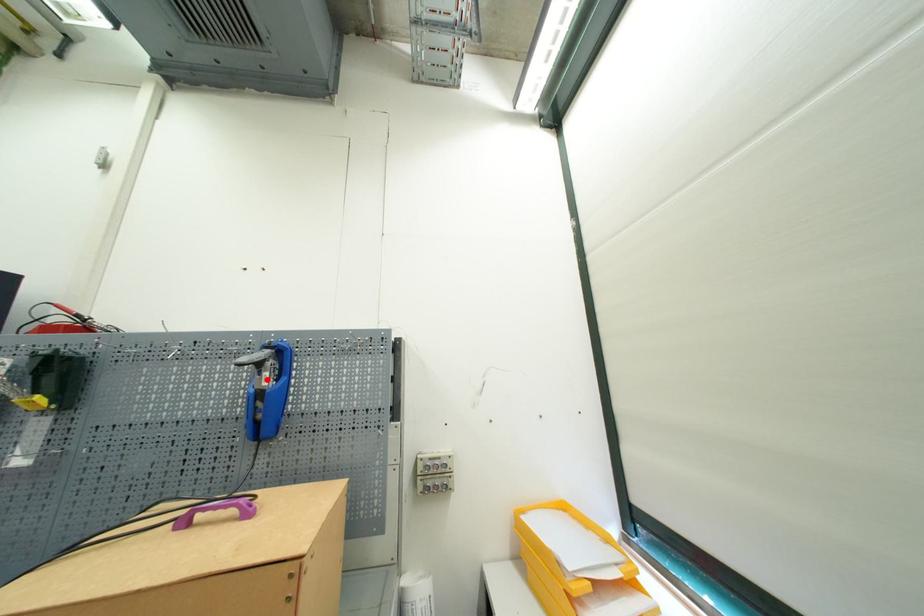
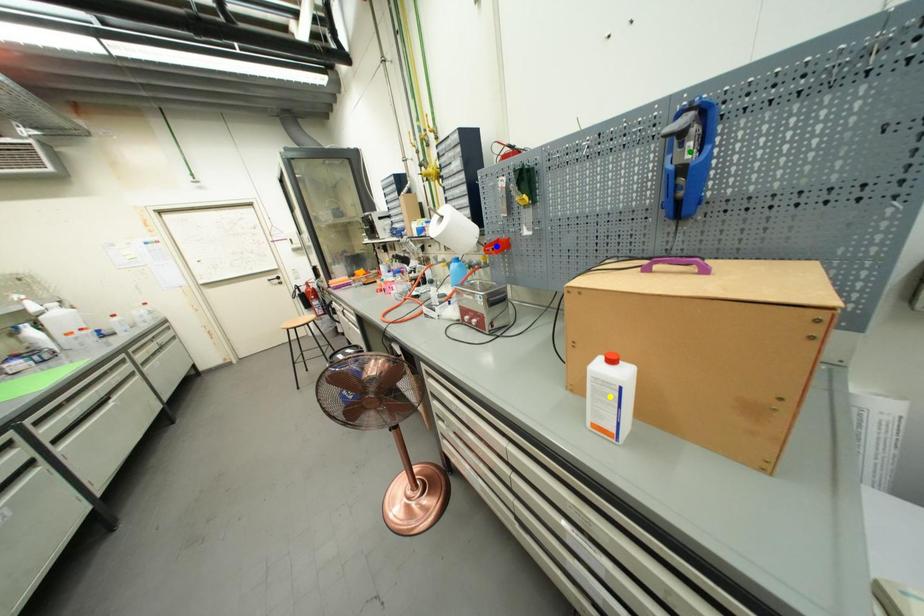
Question: I am providing you with two images of the same scene from different viewpoints. A red point is marked on the first image. You are given multiple points on the second image. Which point in image 2 is actually the same real-world point as the red point in image 1?

Choices:
 (A) yellow point
 (B) blue point
 (C) green point

Answer: (C)